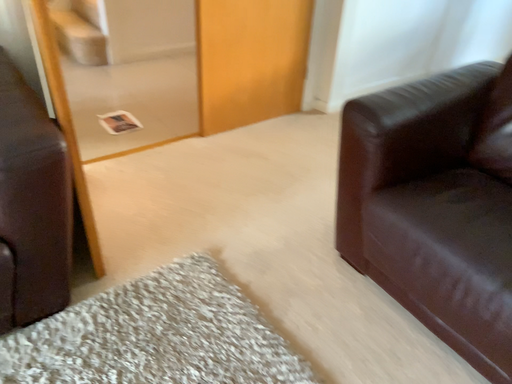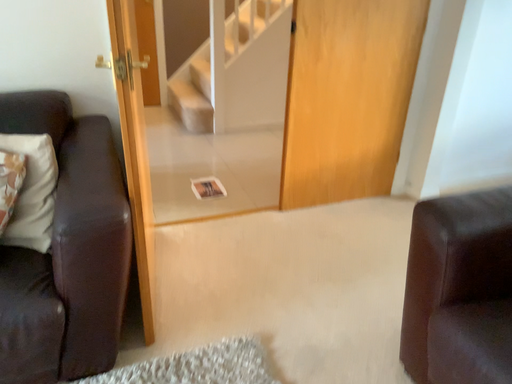
Question: How did the camera likely rotate when shooting the video?

Choices:
 (A) rotated left
 (B) rotated right

Answer: (A)